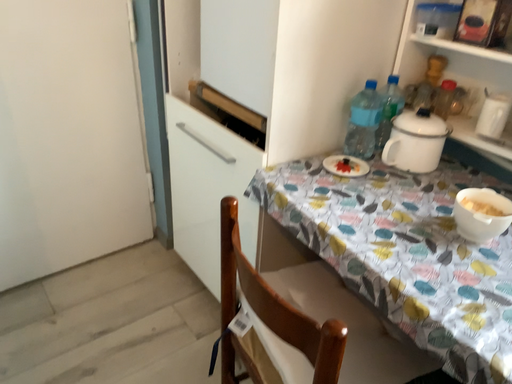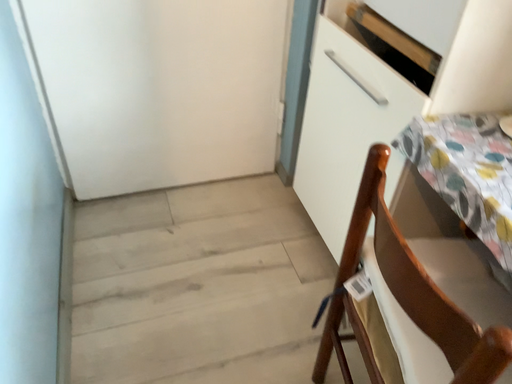
Question: How did the camera likely rotate when shooting the video?

Choices:
 (A) rotated upward
 (B) rotated downward

Answer: (B)